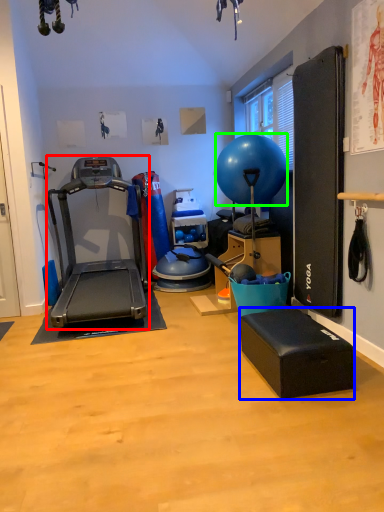
Question: Which object is positioned closest to treadmill (highlighted by a red box)? Select from footrest (highlighted by a blue box) and ball (highlighted by a green box).

Choices:
 (A) footrest
 (B) ball

Answer: (B)